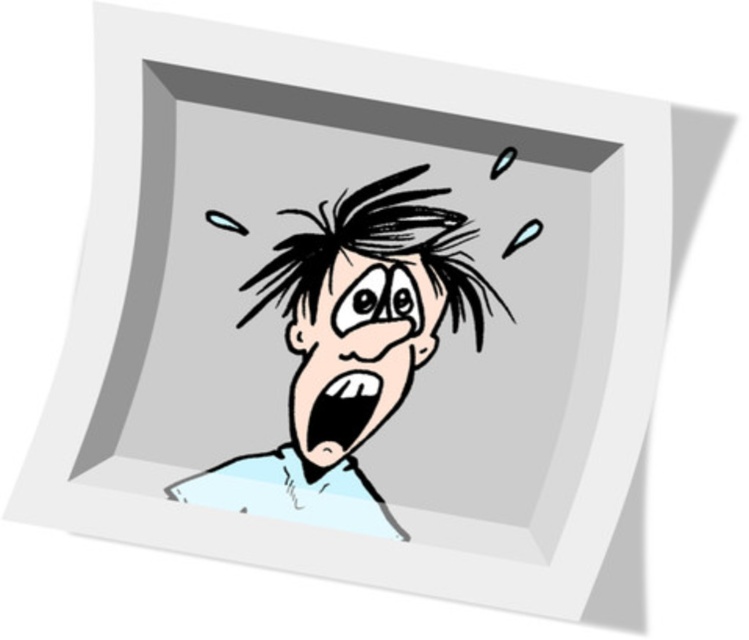
Question: Which of the following is the closest to the observer?

Choices:
 (A) black spiky hair at center
 (B) black matte mouth at center
 (C) white paper face at center
 (D) black glossy mouth at center

Answer: (A)

Question: Does white paper face at center have a larger size compared to black matte mouth at center?

Choices:
 (A) yes
 (B) no

Answer: (A)

Question: Which object is positioned closest to the black glossy mouth at center?

Choices:
 (A) light blue paper at center
 (B) black spiky hair at center
 (C) black matte mouth at center

Answer: (C)

Question: Which object is positioned farthest from the black matte mouth at center?

Choices:
 (A) black spiky hair at center
 (B) light blue paper at center
 (C) black glossy mouth at center
 (D) white paper face at center

Answer: (A)

Question: Is white paper face at center to the right of black glossy mouth at center from the viewer's perspective?

Choices:
 (A) no
 (B) yes

Answer: (B)

Question: Does black spiky hair at center appear under black matte mouth at center?

Choices:
 (A) no
 (B) yes

Answer: (A)